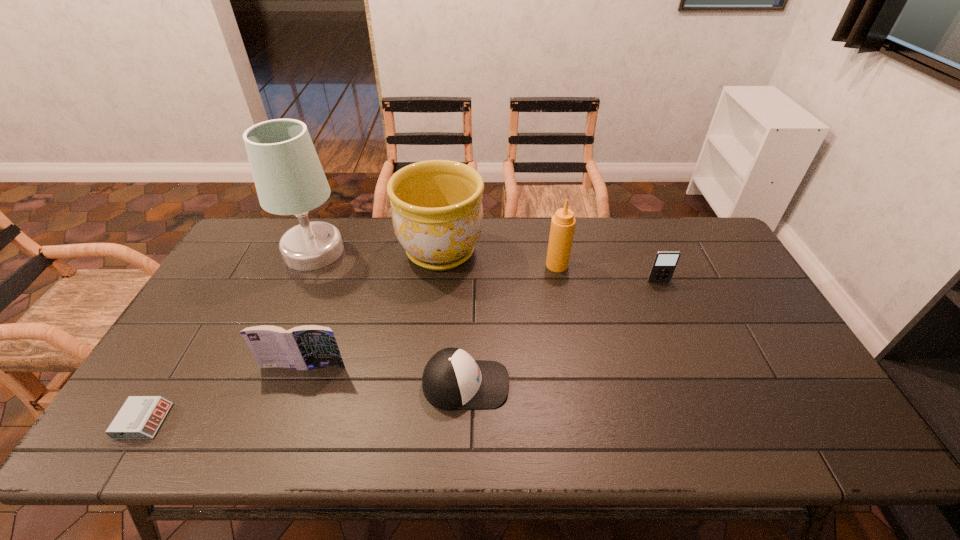
Where is `object that is positioned at the near left corner`? Image resolution: width=960 pixels, height=540 pixels. object that is positioned at the near left corner is located at coordinates (140, 417).

The width and height of the screenshot is (960, 540). I want to click on vacant region at the far edge of the desktop, so click(x=623, y=245).

This screenshot has height=540, width=960. In the image, there is a desktop. What are the coordinates of `vacant region at the near edge` in the screenshot? It's located at (618, 443).

You are a GUI agent. You are given a task and a screenshot of the screen. Output one action in this format:
    pyautogui.click(x=<x>, y=<y>)
    Task: Click on the free space at the left edge of the desktop
    The width and height of the screenshot is (960, 540).
    Given the screenshot: What is the action you would take?
    pyautogui.click(x=169, y=390)

The image size is (960, 540). I want to click on free point at the right edge, so click(x=788, y=401).

Locate an element on the screen. Image resolution: width=960 pixels, height=540 pixels. vacant space at the far right corner of the desktop is located at coordinates (711, 248).

At what (x,y) coordinates should I click in order to perform the action: click on empty location between the tallest object and the iPod. Please return your answer as a coordinate pair (x, y). The image size is (960, 540). Looking at the image, I should click on (486, 266).

Where is `empty space between the cap and the flowerpot`? Image resolution: width=960 pixels, height=540 pixels. empty space between the cap and the flowerpot is located at coordinates (453, 318).

What are the coordinates of `free space that is in between the lampshade and the fourth tallest object` in the screenshot? It's located at (309, 309).

The width and height of the screenshot is (960, 540). I want to click on free space that is in between the book and the flowerpot, so click(372, 309).